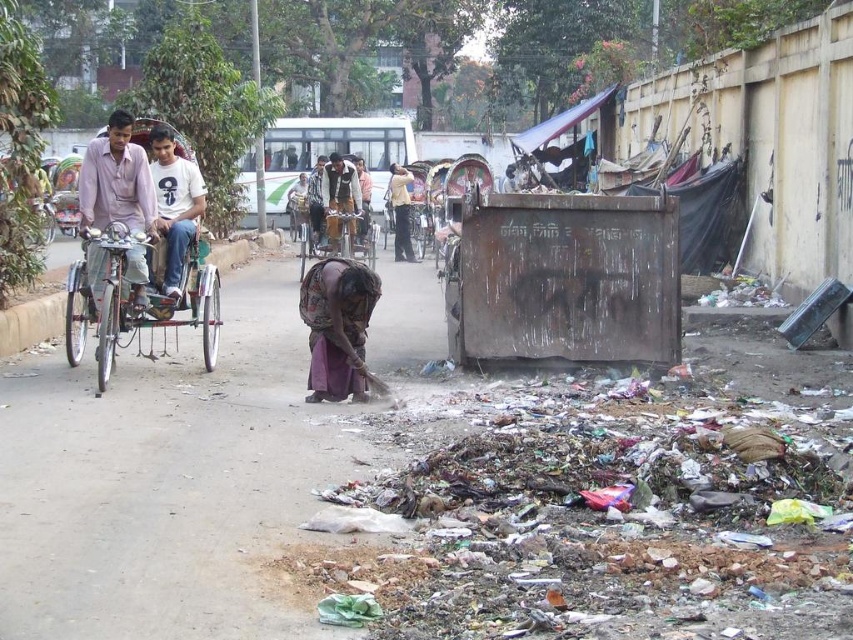
Question: Can you confirm if light pink cotton shirt at left is positioned above dark brown leather jacket at center?

Choices:
 (A) no
 (B) yes

Answer: (A)

Question: Which object is positioned closest to the dark brown leather jacket at center?

Choices:
 (A) metallic silver rickshaw at left
 (B) white cotton shirt at center
 (C) purple fabric at center

Answer: (B)

Question: Which object appears farthest from the camera in this image?

Choices:
 (A) light pink cotton shirt at left
 (B) purple fabric at center
 (C) white cotton shirt at center
 (D) metallic silver rickshaw at left

Answer: (C)

Question: Is white cotton shirt at center positioned in front of dark brown leather jacket at center?

Choices:
 (A) no
 (B) yes

Answer: (B)

Question: In this image, where is purple fabric at center located relative to white cotton shirt at center?

Choices:
 (A) below
 (B) above

Answer: (A)

Question: Which of the following is the closest to the observer?

Choices:
 (A) purple fabric at center
 (B) light pink cotton shirt at left
 (C) metallic silver rickshaw at left
 (D) dark brown leather jacket at center

Answer: (C)